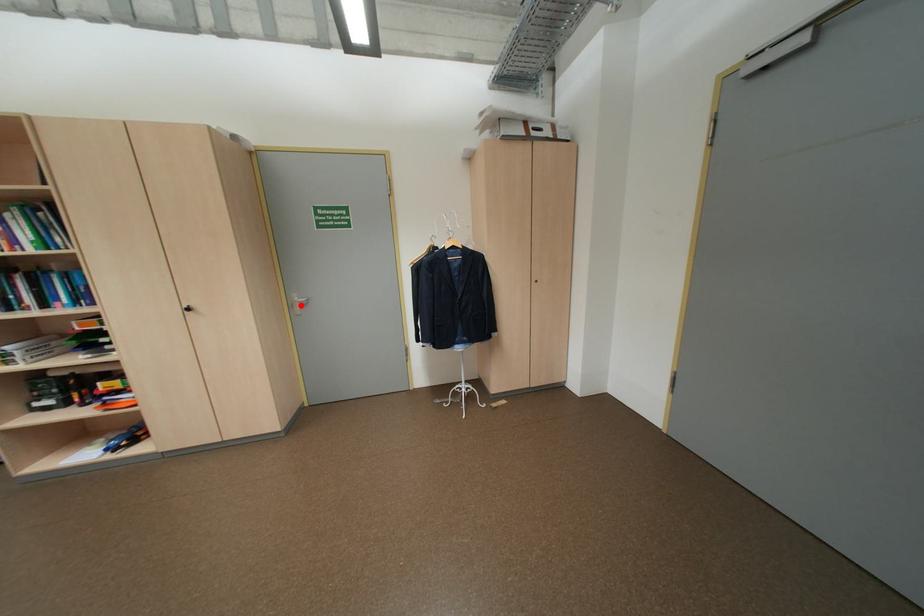
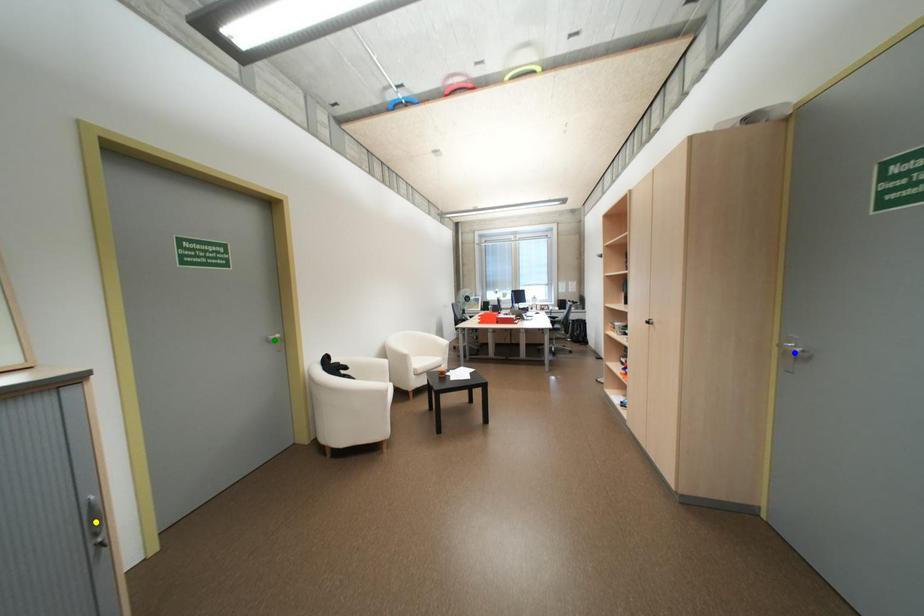
Question: I am providing you with two images of the same scene from different viewpoints. A red point is marked on the first image. You are given multiple points on the second image. Can you choose the point in image 2 that corresponds to the point in image 1?

Choices:
 (A) yellow point
 (B) blue point
 (C) green point

Answer: (B)